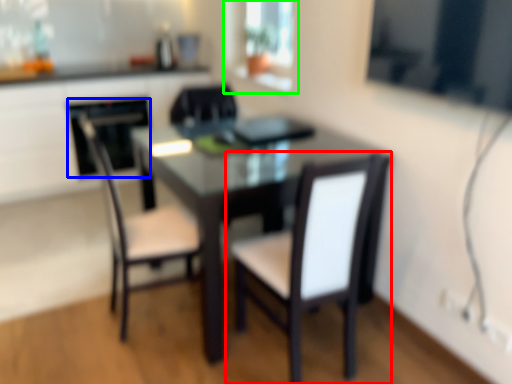
Question: Estimate the real-world distances between objects in this image. Which object is closer to chair (highlighted by a red box), appliance (highlighted by a blue box) or window screen (highlighted by a green box)?

Choices:
 (A) appliance
 (B) window screen

Answer: (B)